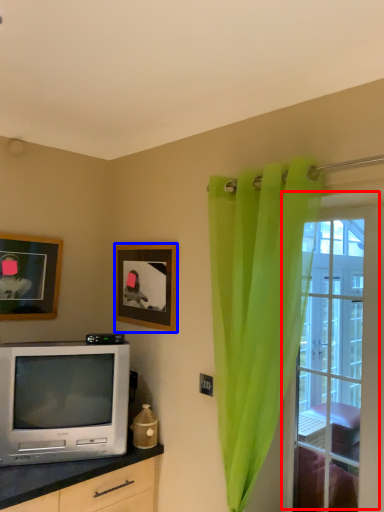
Question: Which of the following is the farthest to the observer, window (highlighted by a red box) or picture frame (highlighted by a blue box)?

Choices:
 (A) window
 (B) picture frame

Answer: (B)